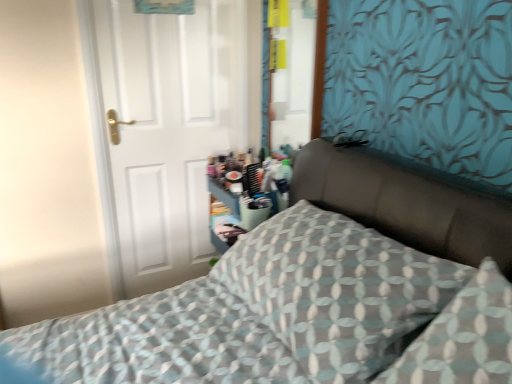
Question: From the image's perspective, does white matte door at left appear lower than patterned fabric pillow at center?

Choices:
 (A) yes
 (B) no

Answer: (B)

Question: Considering the relative sizes of white matte door at left and patterned fabric pillow at center in the image provided, is white matte door at left wider than patterned fabric pillow at center?

Choices:
 (A) yes
 (B) no

Answer: (B)

Question: Does white matte door at left appear on the left side of patterned fabric pillow at center?

Choices:
 (A) yes
 (B) no

Answer: (A)

Question: Are white matte door at left and patterned fabric pillow at center far apart?

Choices:
 (A) no
 (B) yes

Answer: (B)

Question: Considering the relative positions of white matte door at left and patterned fabric pillow at center in the image provided, is white matte door at left behind patterned fabric pillow at center?

Choices:
 (A) no
 (B) yes

Answer: (B)

Question: Can you confirm if white matte door at left is positioned to the right of patterned fabric pillow at center?

Choices:
 (A) yes
 (B) no

Answer: (B)

Question: Can you confirm if patterned fabric pillow at center is thinner than white matte door at left?

Choices:
 (A) yes
 (B) no

Answer: (B)

Question: Is patterned fabric pillow at center to the right of white matte door at left from the viewer's perspective?

Choices:
 (A) yes
 (B) no

Answer: (A)

Question: Is patterned fabric pillow at center looking in the opposite direction of white matte door at left?

Choices:
 (A) yes
 (B) no

Answer: (B)

Question: Considering the relative sizes of patterned fabric pillow at center and white matte door at left in the image provided, is patterned fabric pillow at center wider than white matte door at left?

Choices:
 (A) no
 (B) yes

Answer: (B)

Question: Does patterned fabric pillow at center have a lesser height compared to white matte door at left?

Choices:
 (A) yes
 (B) no

Answer: (A)

Question: Can we say patterned fabric pillow at center lies outside white matte door at left?

Choices:
 (A) no
 (B) yes

Answer: (B)

Question: Is patterned fabric pillow at center turned away from patterned fabric bed at center?

Choices:
 (A) yes
 (B) no

Answer: (A)